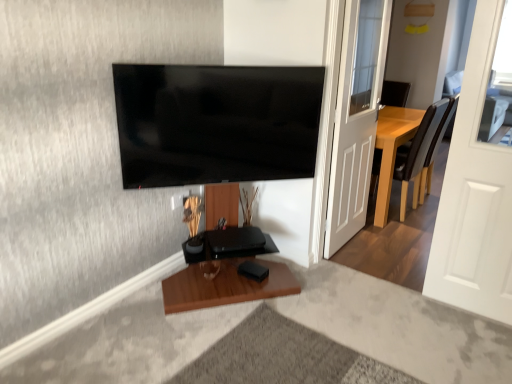
Question: Considering the positions of white matte door at right, the 1th door from the right, and white glossy door at right, which is counted as the first door, starting from the back, in the image, is white matte door at right, the 1th door from the right, wider or thinner than white glossy door at right, which is counted as the first door, starting from the back,?

Choices:
 (A) wide
 (B) thin

Answer: (B)

Question: Is white matte door at right, the 1th door from the right, taller or shorter than white glossy door at right, the 2th door from the right?

Choices:
 (A) tall
 (B) short

Answer: (B)

Question: Based on their relative distances, which object is farther from the brown leather chair at right?

Choices:
 (A) white matte door at right, which is the second door from back to front
 (B) white glossy door at right, the 2th door from the right
 (C) flat screen tv at upper center

Answer: (C)

Question: Which object is positioned closest to the white glossy door at right, which is the first door from left to right?

Choices:
 (A) brown leather chair at right
 (B) white matte door at right, the 1th door from the right
 (C) flat screen tv at upper center

Answer: (A)